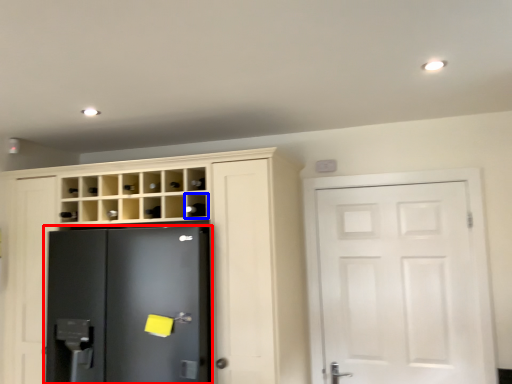
Question: Which object appears farthest to the camera in this image, refrigerator (highlighted by a red box) or shelf (highlighted by a blue box)?

Choices:
 (A) refrigerator
 (B) shelf

Answer: (B)